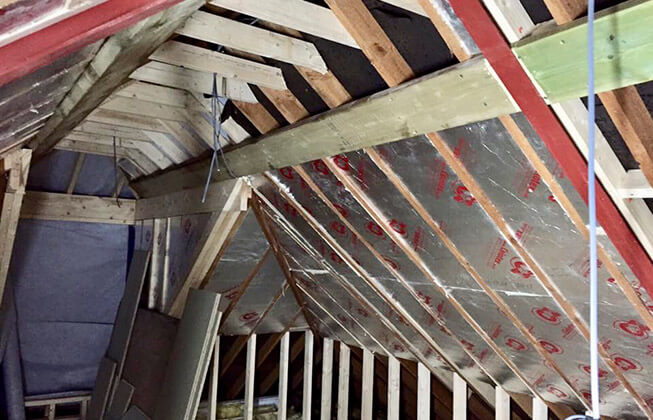
Where is `red beams`? red beams is located at coordinates (8, 57), (471, 20).